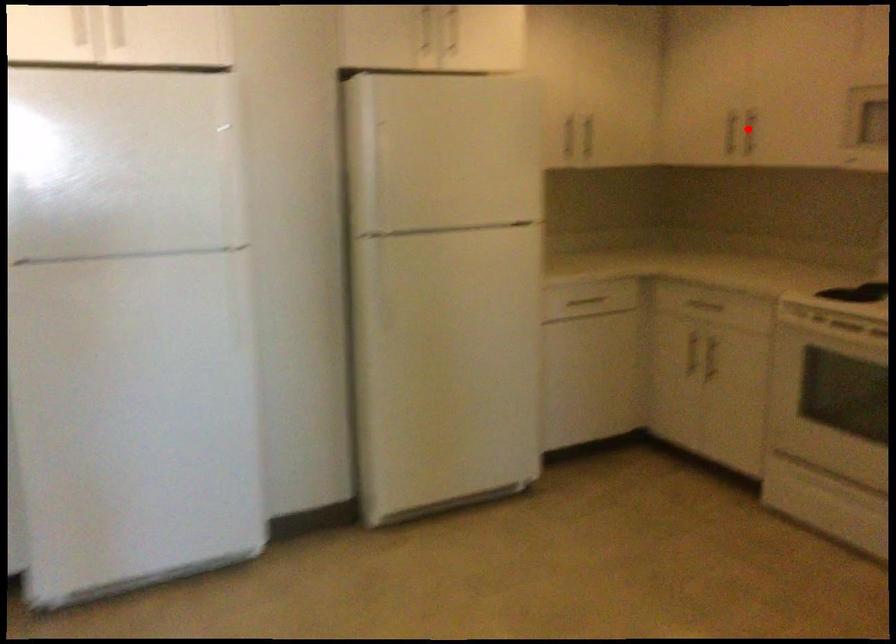
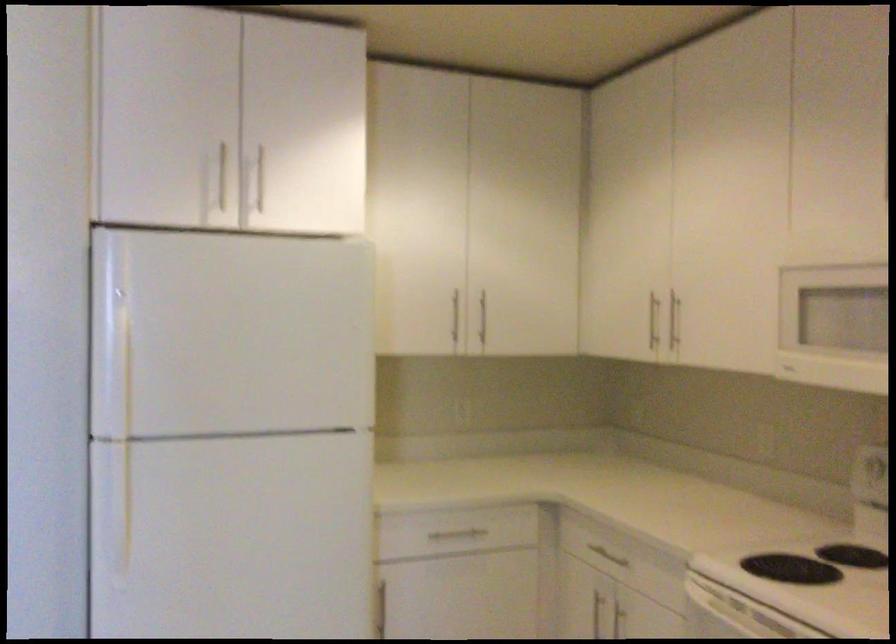
In the second image, find the point that corresponds to the highlighted location in the first image.

(673, 321)